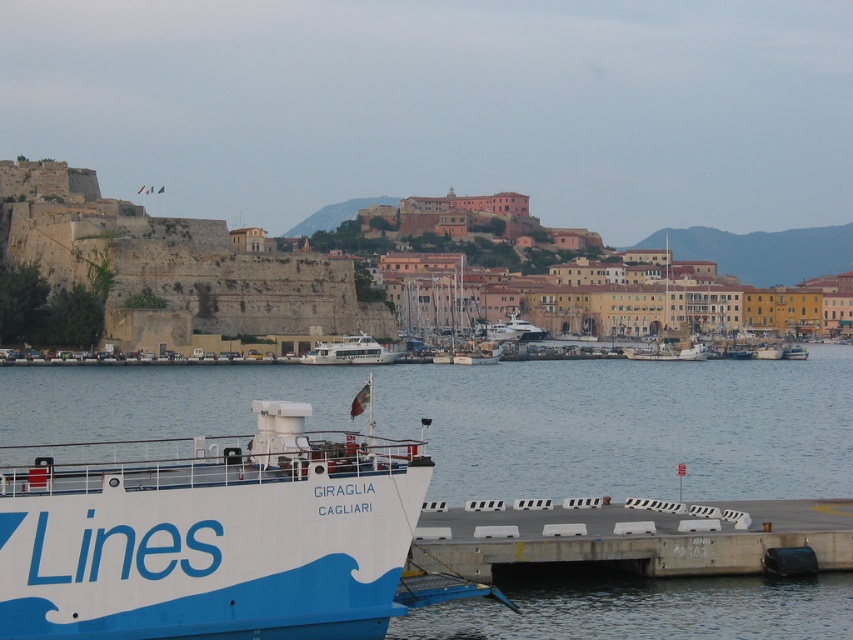
Which of these two, concrete at lower right or white wooden sailboats at center, stands taller?

With more height is white wooden sailboats at center.

Measure the distance from concrete at lower right to white wooden sailboats at center.

323.59 feet

What are the coordinates of `concrete at lower right` in the screenshot? It's located at (635, 538).

This screenshot has height=640, width=853. I want to click on concrete at lower right, so click(x=635, y=538).

Who is positioned more to the left, transparent water at center or white wooden sailboats at center?

From the viewer's perspective, white wooden sailboats at center appears more on the left side.

The width and height of the screenshot is (853, 640). What do you see at coordinates (502, 419) in the screenshot?
I see `transparent water at center` at bounding box center [502, 419].

The height and width of the screenshot is (640, 853). I want to click on transparent water at center, so click(502, 419).

Is concrete at lower right shorter than white glossy ferry at center?

In fact, concrete at lower right may be taller than white glossy ferry at center.

Is concrete at lower right taller than white glossy ferry at center?

Correct, concrete at lower right is much taller as white glossy ferry at center.

Who is more forward, (752, 550) or (328, 346)?

Point (752, 550)

The image size is (853, 640). Identify the location of concrete at lower right. (635, 538).